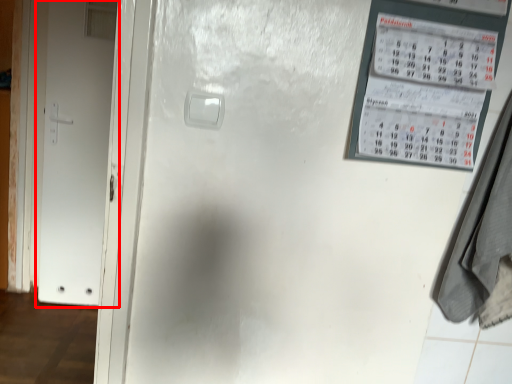
Question: In this image, where is door (annotated by the red box) located relative to laundry?

Choices:
 (A) right
 (B) left

Answer: (B)